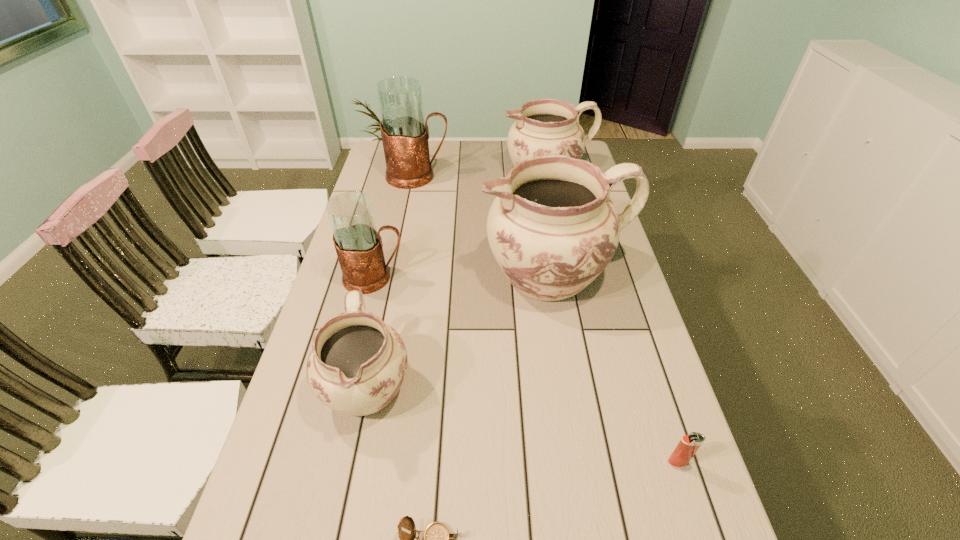
Where is `object positioned at the far right corner`? This screenshot has width=960, height=540. object positioned at the far right corner is located at coordinates (547, 126).

The height and width of the screenshot is (540, 960). Identify the location of free space at the far edge of the desktop. (504, 166).

You are a GUI agent. You are given a task and a screenshot of the screen. Output one action in this format:
    pyautogui.click(x=<x>, y=<y>)
    Task: Click on the free space at the left edge of the desktop
    
    Given the screenshot: What is the action you would take?
    pyautogui.click(x=374, y=312)

In the image, there is a desktop. Where is `vacant space at the right edge`? This screenshot has width=960, height=540. vacant space at the right edge is located at coordinates (600, 363).

At what (x,y) coordinates should I click in order to perform the action: click on vacant area between the second smallest purple pitcher and the nearest purple pitcher. Please return your answer as a coordinate pair (x, y). The height and width of the screenshot is (540, 960). Looking at the image, I should click on (457, 280).

Locate an element on the screen. free spot between the smaller gray pitcher and the bigger gray pitcher is located at coordinates (396, 227).

Locate an element on the screen. free space between the biggest purple pitcher and the sixth tallest object is located at coordinates (615, 368).

Where is `free space between the leftmost purple pitcher and the second farthest purple pitcher`? free space between the leftmost purple pitcher and the second farthest purple pitcher is located at coordinates (461, 330).

Identify which object is located as the sixth nearest to the second biggest purple pitcher. Please provide its 2D coordinates. Your answer should be formatted as a tuple, i.e. [(x, y)], where the tuple contains the x and y coordinates of a point satisfying the conditions above.

[(437, 539)]

At what (x,y) coordinates should I click in order to perform the action: click on the fourth closest object to the second smallest purple pitcher. Please return your answer as a coordinate pair (x, y). The width and height of the screenshot is (960, 540). Looking at the image, I should click on (357, 364).